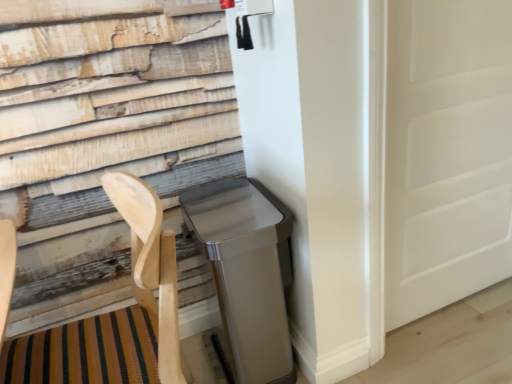
Question: Can you confirm if natural wood folding chair at lower left is taller than white matte door at right?

Choices:
 (A) no
 (B) yes

Answer: (A)

Question: Are natural wood folding chair at lower left and white matte door at right far apart?

Choices:
 (A) no
 (B) yes

Answer: (A)

Question: Is natural wood folding chair at lower left at the left side of white matte door at right?

Choices:
 (A) yes
 (B) no

Answer: (A)

Question: Considering the relative sizes of natural wood folding chair at lower left and white matte door at right in the image provided, is natural wood folding chair at lower left wider than white matte door at right?

Choices:
 (A) no
 (B) yes

Answer: (B)

Question: Is natural wood folding chair at lower left further to the viewer compared to white matte door at right?

Choices:
 (A) yes
 (B) no

Answer: (B)

Question: Based on their sizes in the image, would you say satin silver trash can at lower right is bigger or smaller than natural wood folding chair at lower left?

Choices:
 (A) small
 (B) big

Answer: (A)

Question: Considering their positions, is satin silver trash can at lower right located in front of or behind natural wood folding chair at lower left?

Choices:
 (A) front
 (B) behind

Answer: (B)

Question: In the image, is satin silver trash can at lower right on the left side or the right side of natural wood folding chair at lower left?

Choices:
 (A) right
 (B) left

Answer: (A)

Question: Is satin silver trash can at lower right situated inside natural wood folding chair at lower left or outside?

Choices:
 (A) outside
 (B) inside

Answer: (A)

Question: In terms of size, does white matte door at right appear bigger or smaller than natural wood folding chair at lower left?

Choices:
 (A) small
 (B) big

Answer: (A)

Question: Based on their positions, is white matte door at right located to the left or right of natural wood folding chair at lower left?

Choices:
 (A) right
 (B) left

Answer: (A)

Question: Looking at their shapes, would you say white matte door at right is wider or thinner than natural wood folding chair at lower left?

Choices:
 (A) thin
 (B) wide

Answer: (A)

Question: Is point (415, 13) closer or farther from the camera than point (166, 231)?

Choices:
 (A) farther
 (B) closer

Answer: (B)

Question: From a real-world perspective, is satin silver trash can at lower right above or below white matte door at right?

Choices:
 (A) below
 (B) above

Answer: (A)

Question: Does point (239, 329) appear closer or farther from the camera than point (508, 261)?

Choices:
 (A) farther
 (B) closer

Answer: (B)